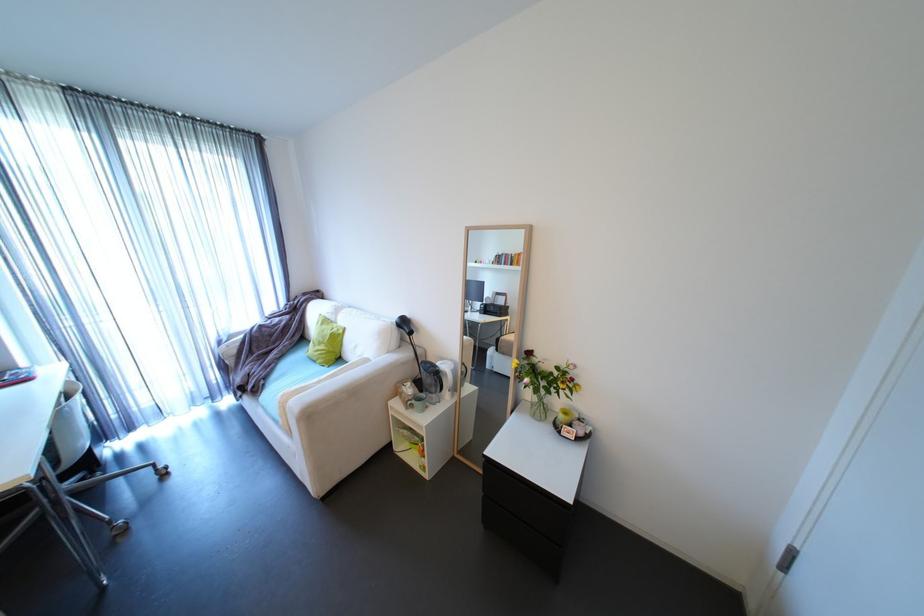
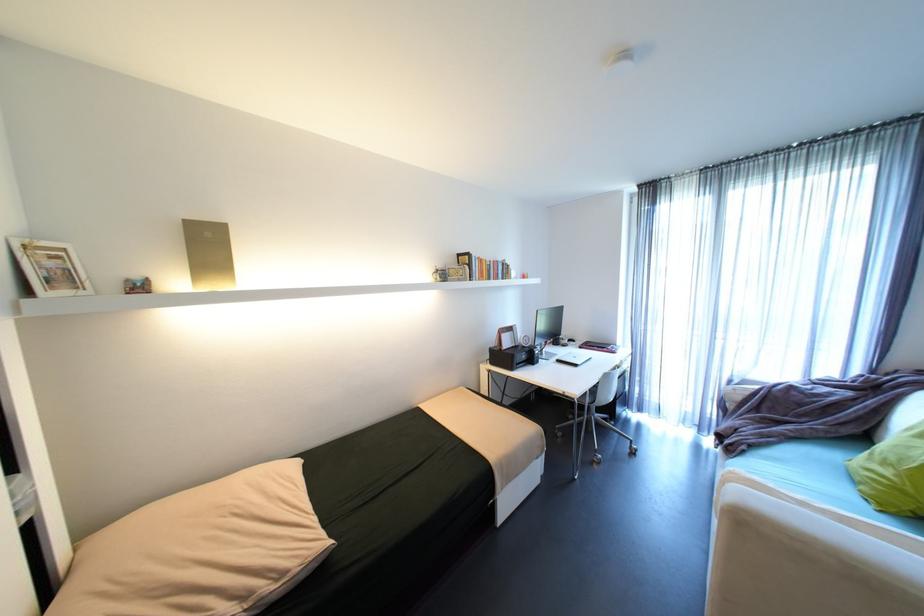
In the second image, find the point that corresponds to the point at 271,385 in the first image.

(751, 451)